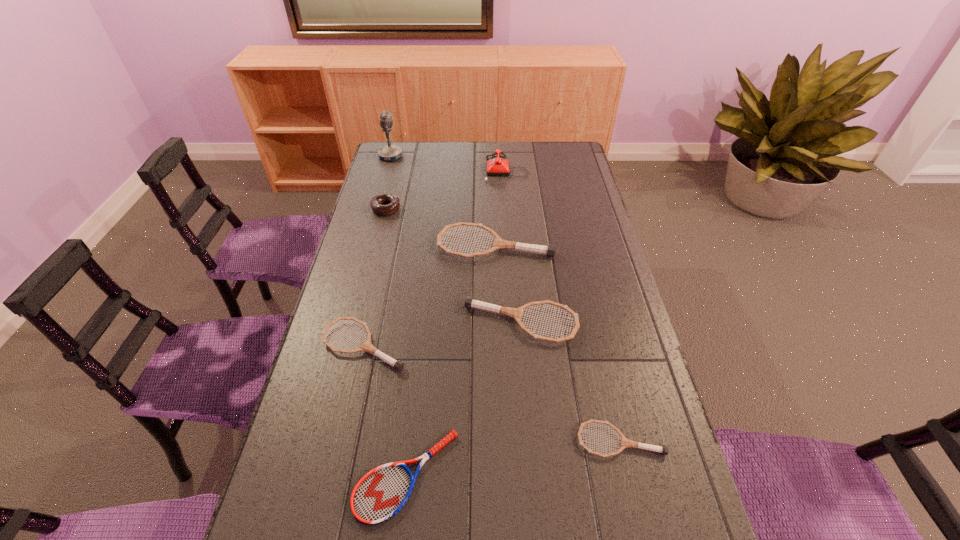
Identify the location of free spot located 0.320m on the left of the fourth shortest tennis racket. (355, 323).

Image resolution: width=960 pixels, height=540 pixels. I want to click on free space located on the back of the third shortest object, so click(x=375, y=293).

Where is `blank space located on the front of the nearest gray tennis racket`? blank space located on the front of the nearest gray tennis racket is located at coordinates (631, 487).

The height and width of the screenshot is (540, 960). I want to click on vacant region located on the right of the shortest tennis racket, so click(506, 475).

The height and width of the screenshot is (540, 960). I want to click on microphone that is at the far edge, so click(x=390, y=152).

The height and width of the screenshot is (540, 960). Find the location of `telephone that is positioned at the far edge`. telephone that is positioned at the far edge is located at coordinates coord(495,167).

The height and width of the screenshot is (540, 960). I want to click on microphone located at the left edge, so click(390, 152).

At what (x,y) coordinates should I click in order to perform the action: click on doughnut that is at the left edge. Please return your answer as a coordinate pair (x, y). Image resolution: width=960 pixels, height=540 pixels. Looking at the image, I should click on (393, 203).

Locate an element on the screen. tennis racket that is at the left edge is located at coordinates (398, 365).

The width and height of the screenshot is (960, 540). I want to click on object positioned at the far left corner, so click(390, 152).